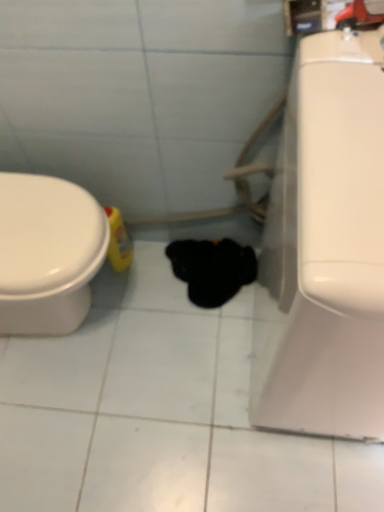
Locate an element on the screen. The image size is (384, 512). empty space that is in between white glossy toilet at right and black fuzzy cat at center is located at coordinates (221, 345).